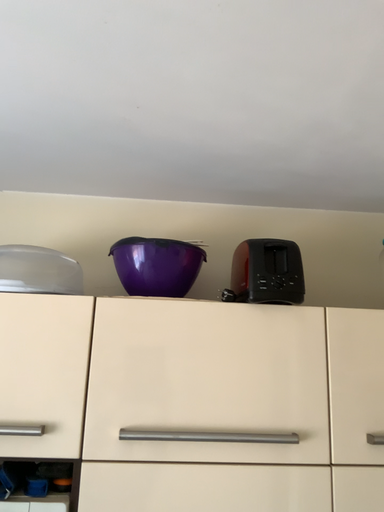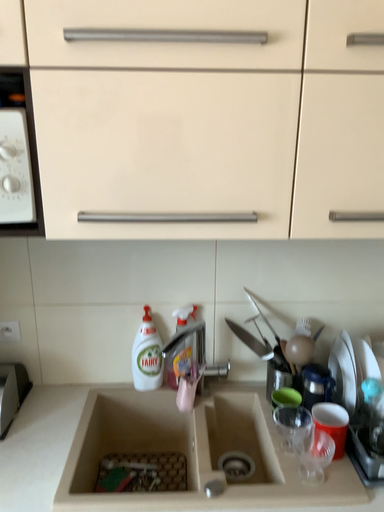
Question: Which way did the camera rotate in the video?

Choices:
 (A) rotated downward
 (B) rotated upward

Answer: (A)